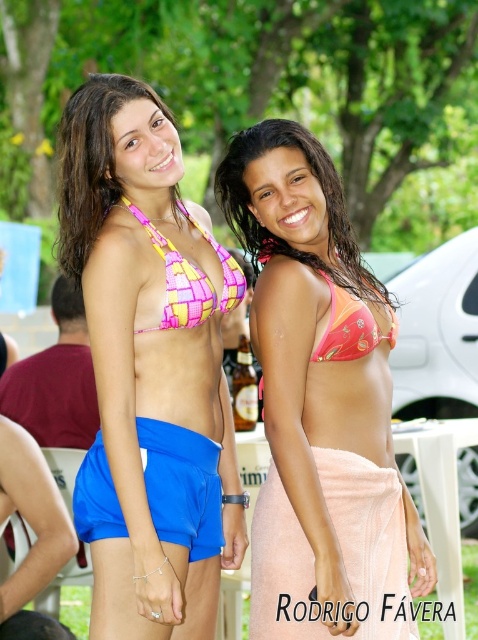
Consider the image. You are a photographer trying to capture a candid shot of both the pink woven bikini top at center and the pink fabric bikini at center. Since you want to ensure both are clearly visible in the frame, which one should you focus on first to account for their size difference?

The pink woven bikini top at center is much taller than the pink fabric bikini at center, so you should focus on the pink woven bikini top at center first to ensure it is in clear focus before adjusting the frame for the smaller one.

You are a photographer at the event and want to capture a photo where both the pink fabric bikini at center and the pink matte bikini at center are clearly visible. Based on their positions, which one should you focus on first to ensure both are in frame?

The pink fabric bikini at center is located below the pink matte bikini at center, so you should focus on the pink matte bikini at center first to ensure both are in frame.